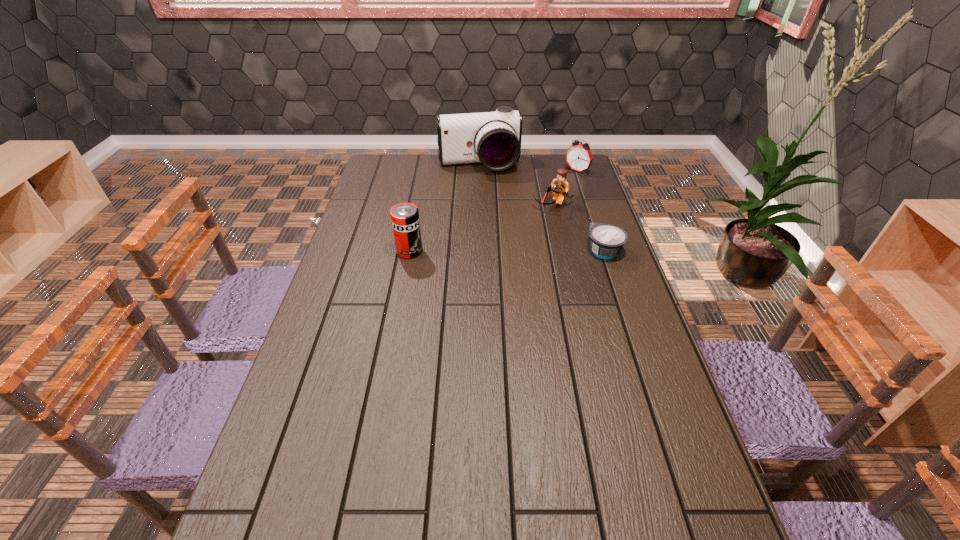
Locate an element on the screen. This screenshot has width=960, height=540. vacant area in the image that satisfies the following two spatial constraints: 1. on the front side of the alarm clock; 2. on the left side of the tallest object is located at coordinates (479, 171).

The image size is (960, 540). In order to click on blank area in the image that satisfies the following two spatial constraints: 1. on the front side of the Lego; 2. on the right side of the shortest object in this screenshot , I will do `click(564, 251)`.